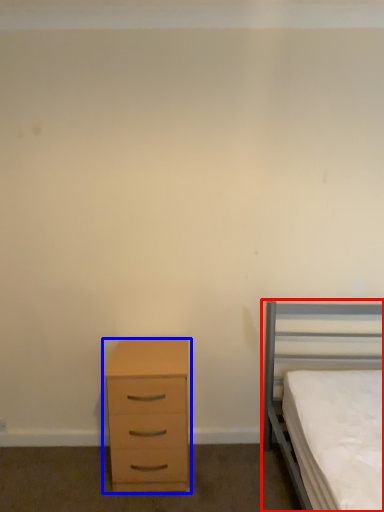
Question: Which point is closer to the camera, bed (highlighted by a red box) or chest of drawers (highlighted by a blue box)?

Choices:
 (A) bed
 (B) chest of drawers

Answer: (A)